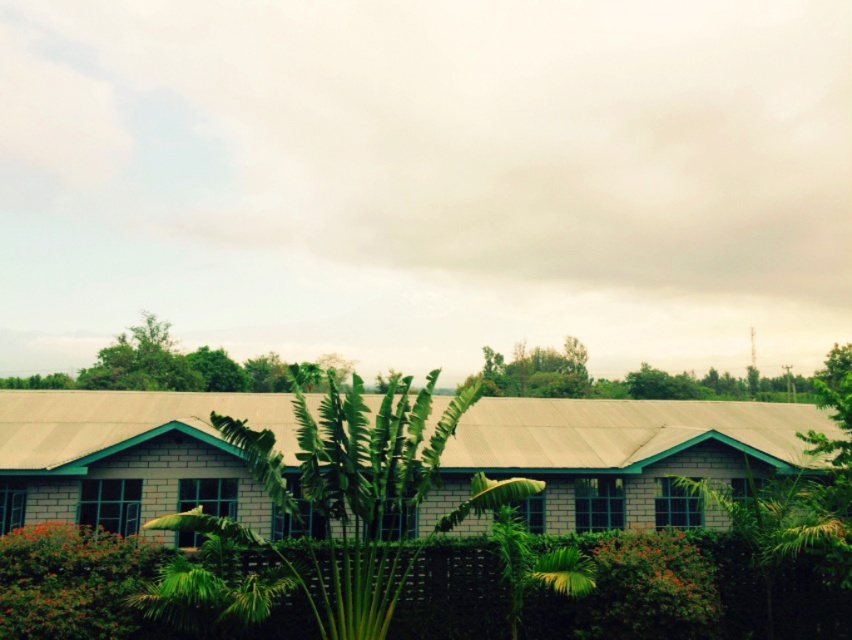
You are standing at the origin point in the image. The white brick building at center is located at coordinates approximately 0.713 on the x and 0.730 on the y axis. If you want to walk directly towards the building, in which general direction should you move relative to your current position?

To walk directly towards the white brick building at center located at coordinates approximately 0.713 on the x and 0.730 on the y axis, you should move in the general direction of northeast, as the building is positioned northeast of your current position at the origin.

You are planning to take a photo of the white brick building at center and the green leafy tree at center. Based on their sizes, which one should you focus on to ensure both fit in the frame without cropping?

The white brick building at center is wider than the green leafy tree at center, so you should focus on the white brick building at center to ensure both fit in the frame without cropping.